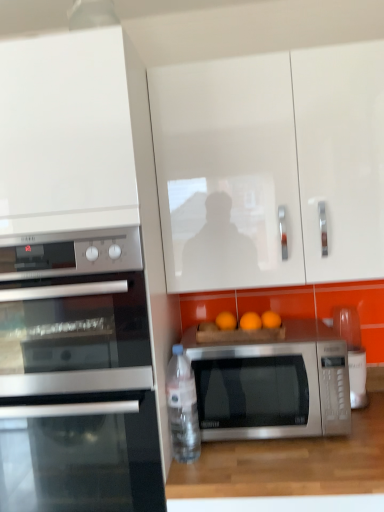
Question: Can you confirm if satin black oven at left is taller than white glossy cabinet at upper left, which appears as the first cabinetry when viewed from the left?

Choices:
 (A) yes
 (B) no

Answer: (B)

Question: Considering the relative positions of satin black oven at left and white glossy cabinet at upper left, which is the 2th cabinetry from right to left, in the image provided, is satin black oven at left to the left of white glossy cabinet at upper left, which is the 2th cabinetry from right to left, from the viewer's perspective?

Choices:
 (A) yes
 (B) no

Answer: (B)

Question: Can you confirm if satin black oven at left is bigger than white glossy cabinet at upper left, which appears as the first cabinetry when viewed from the left?

Choices:
 (A) yes
 (B) no

Answer: (B)

Question: Is satin black oven at left smaller than white glossy cabinet at upper left, which is the 2th cabinetry from right to left?

Choices:
 (A) yes
 (B) no

Answer: (A)

Question: From the image's perspective, does satin black oven at left appear higher than white glossy cabinet at upper left, which is the 2th cabinetry from right to left?

Choices:
 (A) yes
 (B) no

Answer: (B)

Question: Is satin black oven at left with white glossy cabinet at upper left, which appears as the first cabinetry when viewed from the left?

Choices:
 (A) no
 (B) yes

Answer: (A)

Question: From the image's perspective, would you say wooden at lower center is shown under satin silver microwave at left, the 2th microwave oven positioned from the right?

Choices:
 (A) yes
 (B) no

Answer: (A)

Question: From a real-world perspective, is wooden at lower center below satin silver microwave at left, positioned as the 1th microwave oven in left-to-right order?

Choices:
 (A) yes
 (B) no

Answer: (A)

Question: Considering the relative sizes of wooden at lower center and satin silver microwave at left, positioned as the 1th microwave oven in left-to-right order, in the image provided, is wooden at lower center bigger than satin silver microwave at left, positioned as the 1th microwave oven in left-to-right order,?

Choices:
 (A) no
 (B) yes

Answer: (B)

Question: Does wooden at lower center have a greater width compared to satin silver microwave at left, positioned as the 1th microwave oven in left-to-right order?

Choices:
 (A) no
 (B) yes

Answer: (B)

Question: From a real-world perspective, is wooden at lower center located higher than satin silver microwave at left, the 2th microwave oven positioned from the right?

Choices:
 (A) yes
 (B) no

Answer: (B)

Question: Can you confirm if wooden at lower center is thinner than satin silver microwave at left, positioned as the 1th microwave oven in left-to-right order?

Choices:
 (A) yes
 (B) no

Answer: (B)

Question: From a real-world perspective, does wooden at lower center sit lower than white glossy cabinet at upper center, placed as the 2th cabinetry when sorted from left to right?

Choices:
 (A) yes
 (B) no

Answer: (A)